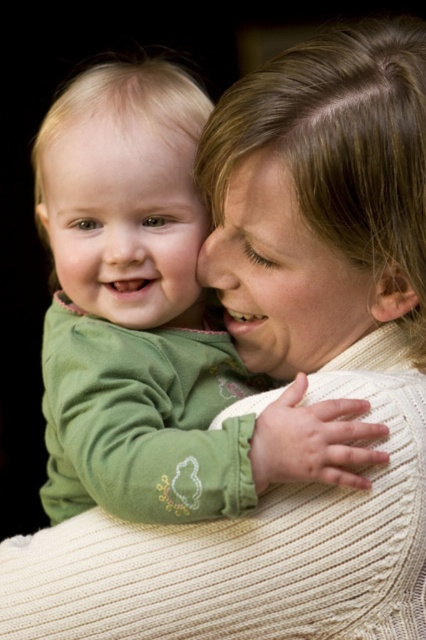
Between point (123, 436) and point (196, 269), which one is positioned in front?

Point (123, 436) is more forward.

Is point (143, 72) farther from camera compared to point (230, 256)?

No, (143, 72) is closer to viewer.

Is point (161, 307) positioned behind point (247, 192)?

Yes, point (161, 307) is behind point (247, 192).

Locate an element on the screen. Image resolution: width=426 pixels, height=640 pixels. green soft fabric baby at center is located at coordinates point(155,323).

Which is behind, point (141, 326) or point (293, 228)?

Positioned behind is point (141, 326).

Does smooth green baby at center lie behind smooth skin face at center?

That is True.

Measure the distance between point (141, 163) and camera.

Point (141, 163) and camera are 32.18 inches apart.

Identify the location of smooth green baby at center. This screenshot has width=426, height=640. (124, 220).

Does green soft fabric baby at center have a larger size compared to smooth green baby at center?

Yes, green soft fabric baby at center is bigger than smooth green baby at center.

Which is behind, point (115, 401) or point (201, 296)?

The point (201, 296) is more distant.

Does point (68, 160) come farther from viewer compared to point (69, 170)?

No, it is not.

Where is `green soft fabric baby at center`? The image size is (426, 640). green soft fabric baby at center is located at coordinates (155, 323).